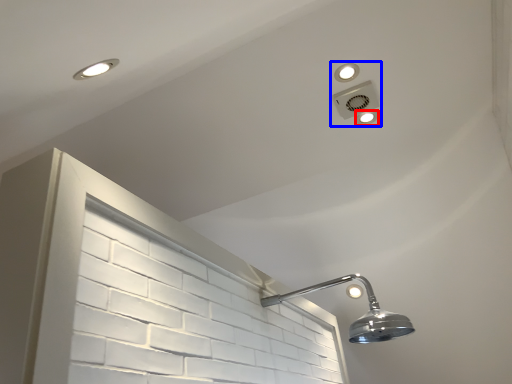
Question: Which of the following is the farthest to the observer, dot (highlighted by a red box) or fixture (highlighted by a blue box)?

Choices:
 (A) dot
 (B) fixture

Answer: (A)